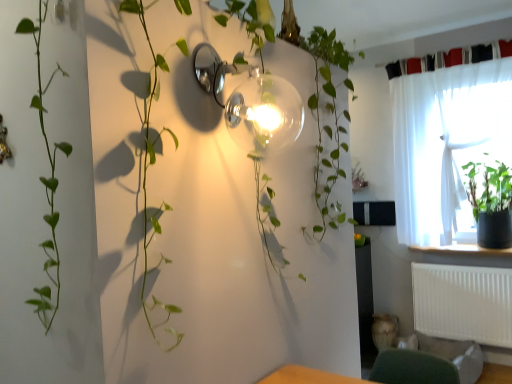
Question: In terms of height, does black fabric curtain at upper right, which ranks as the second curtain in bottom-to-top order, look taller or shorter compared to white glossy window sill at right?

Choices:
 (A) tall
 (B) short

Answer: (B)

Question: Choose the correct answer: Is black fabric curtain at upper right, which is counted as the first curtain, starting from the top, inside white glossy window sill at right or outside it?

Choices:
 (A) inside
 (B) outside

Answer: (B)

Question: Which is farther from the white glossy window sill at right?

Choices:
 (A) black fabric curtain at upper right, which is counted as the first curtain, starting from the top
 (B) green matte plant at right
 (C) white plastic radiator at lower right
 (D) white sheer curtain at upper right, which is the 1th curtain from bottom to top
 (E) green fabric swivel chair at lower right

Answer: (A)

Question: Which is nearer to the green matte plant at right?

Choices:
 (A) white sheer curtain at upper right, which is the 1th curtain from bottom to top
 (B) white glossy window sill at right
 (C) green fabric swivel chair at lower right
 (D) clear glass globe at upper center
 (E) black fabric curtain at upper right, which is counted as the first curtain, starting from the top

Answer: (A)